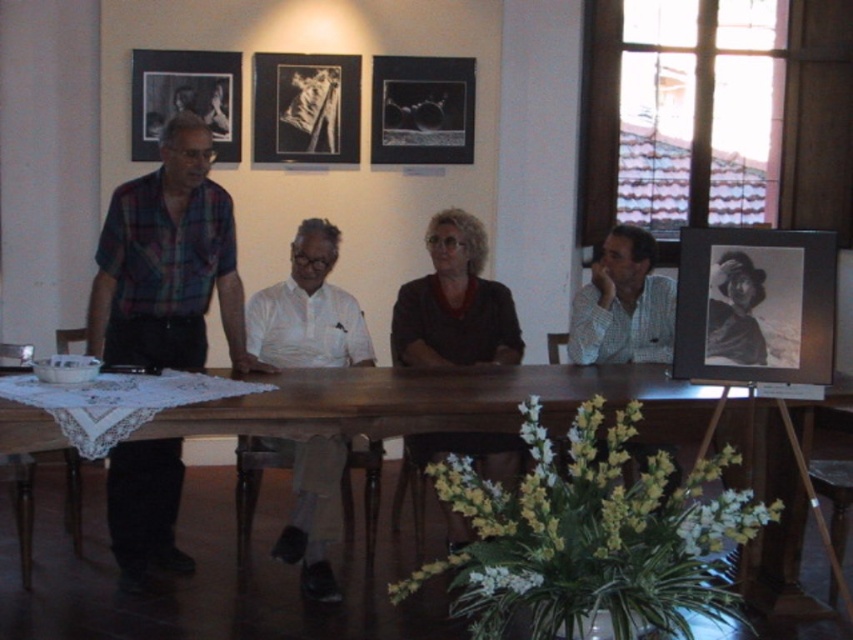
You are an interior designer assessing the placement of two black matte picture frames in a room. The frames are labeled as the black matte picture frame at upper center and the black matte picture frame at upper left. Based on their positions, which frame is located to the right of the other?

The black matte picture frame at upper center is positioned on the right side of the black matte picture frame at upper left, so the frame at upper center is to the right of the one at upper left.

You are an interior designer observing the scene. You need to determine if the brown matte shirt at center can be placed inside the black matte picture frame at upper center without overlapping its edges. Can it fit?

The brown matte shirt at center has a lesser width compared to the black matte picture frame at upper center, so it can fit inside the frame without overlapping the edges.

You are standing at the point labeled as point [454,304] in the image. What object are you touching?

The point labeled as point [454,304] is on the brown matte shirt at center, so you are touching the brown matte shirt at center.